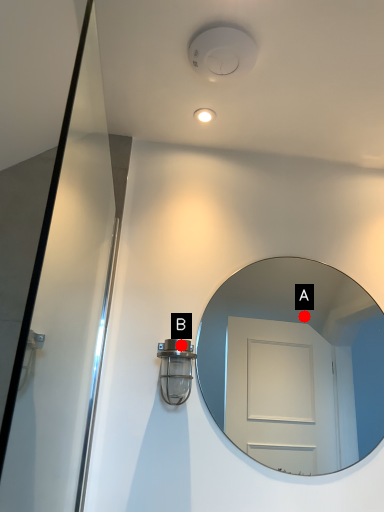
Question: Two points are circled on the image, labeled by A and B beside each circle. Which point is farther to the camera?

Choices:
 (A) A is further
 (B) B is further

Answer: (A)